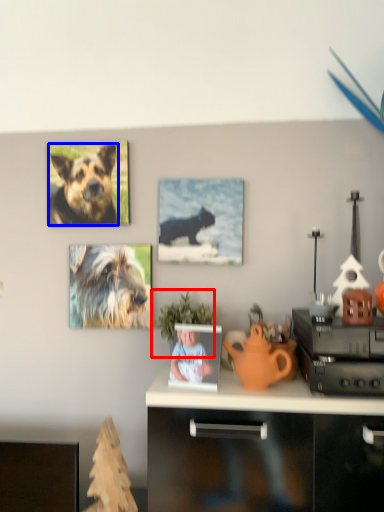
Question: Which object appears closest to the camera in this image, houseplant (highlighted by a red box) or dog (highlighted by a blue box)?

Choices:
 (A) houseplant
 (B) dog

Answer: (A)